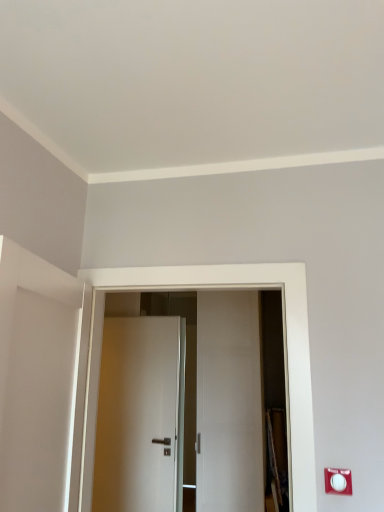
Question: Which direction should I rotate to look at white glossy door at center, which is counted as the 2th door, starting from the back?

Choices:
 (A) right
 (B) left

Answer: (B)

Question: Does white plastic electric outlet at lower right appear on the left side of white glossy door at center, which appears as the 1th door when viewed from the front?

Choices:
 (A) yes
 (B) no

Answer: (B)

Question: From the image's perspective, is white plastic electric outlet at lower right located above white glossy door at center, which appears as the 1th door when viewed from the front?

Choices:
 (A) yes
 (B) no

Answer: (B)

Question: Considering the relative sizes of white plastic electric outlet at lower right and white glossy door at center, which is counted as the 2th door, starting from the back, in the image provided, is white plastic electric outlet at lower right bigger than white glossy door at center, which is counted as the 2th door, starting from the back,?

Choices:
 (A) no
 (B) yes

Answer: (A)

Question: From a real-world perspective, is white plastic electric outlet at lower right under white glossy door at center, which appears as the 1th door when viewed from the front?

Choices:
 (A) no
 (B) yes

Answer: (B)

Question: Is white plastic electric outlet at lower right far from white glossy door at center, which is counted as the 2th door, starting from the back?

Choices:
 (A) no
 (B) yes

Answer: (A)

Question: Considering the relative sizes of white plastic electric outlet at lower right and white glossy door at center, which appears as the 1th door when viewed from the front, in the image provided, is white plastic electric outlet at lower right shorter than white glossy door at center, which appears as the 1th door when viewed from the front,?

Choices:
 (A) yes
 (B) no

Answer: (A)

Question: Can you confirm if white glossy door at center, which appears as the 1th door when viewed from the front, is positioned to the left of white matte door at center, which is the first door in back-to-front order?

Choices:
 (A) yes
 (B) no

Answer: (B)

Question: Considering the relative sizes of white glossy door at center, which appears as the 1th door when viewed from the front, and white matte door at center, which is the first door in back-to-front order, in the image provided, is white glossy door at center, which appears as the 1th door when viewed from the front, bigger than white matte door at center, which is the first door in back-to-front order,?

Choices:
 (A) no
 (B) yes

Answer: (B)

Question: Is white glossy door at center, which is counted as the 2th door, starting from the back, in contact with white matte door at center, the second door viewed from the front?

Choices:
 (A) yes
 (B) no

Answer: (B)

Question: Would you say white glossy door at center, which is counted as the 2th door, starting from the back, is outside white matte door at center, the second door viewed from the front?

Choices:
 (A) yes
 (B) no

Answer: (A)

Question: Are white glossy door at center, which appears as the 1th door when viewed from the front, and white matte door at center, the second door viewed from the front, far apart?

Choices:
 (A) yes
 (B) no

Answer: (A)

Question: Is white glossy door at center, which is counted as the 2th door, starting from the back, to the right of white matte door at center, the second door viewed from the front, from the viewer's perspective?

Choices:
 (A) no
 (B) yes

Answer: (B)

Question: Does white plastic electric outlet at lower right have a greater height compared to white matte door at center, the second door viewed from the front?

Choices:
 (A) yes
 (B) no

Answer: (B)